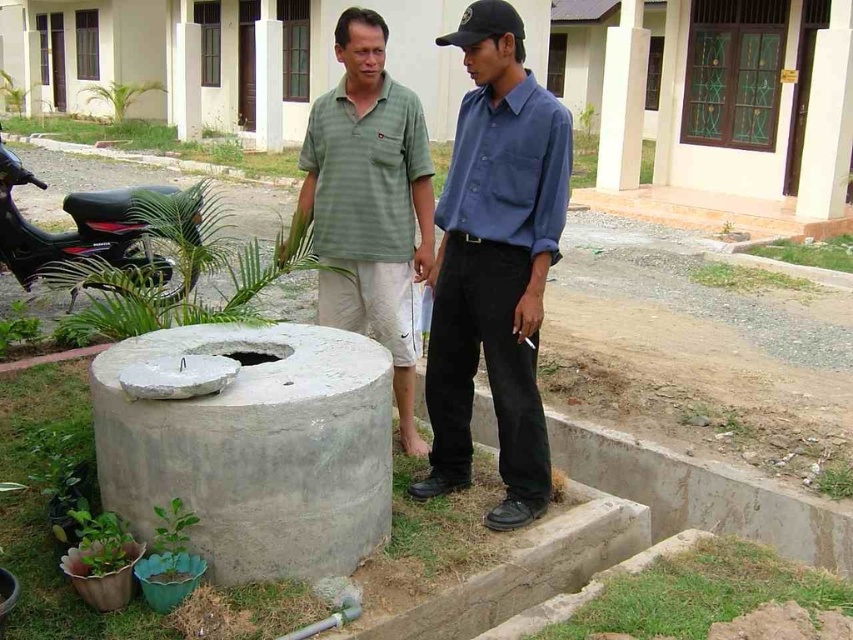
Is gray concrete at lower left positioned behind black matte motorcycle at left?

That is False.

Identify the location of gray concrete at lower left. (254, 449).

Locate an element on the screen. The height and width of the screenshot is (640, 853). gray concrete at lower left is located at coordinates [254, 449].

Which is above, green striped polo shirt at center or black matte motorcycle at left?

black matte motorcycle at left is higher up.

Can you confirm if green striped polo shirt at center is positioned to the left of black matte motorcycle at left?

No, green striped polo shirt at center is not to the left of black matte motorcycle at left.

Is point (351, 81) closer to viewer compared to point (28, 243)?

Yes, point (351, 81) is closer to viewer.

Locate an element on the screen. The width and height of the screenshot is (853, 640). green striped polo shirt at center is located at coordinates (369, 202).

Can you confirm if blue cotton shirt at center is positioned to the left of green striped polo shirt at center?

No, blue cotton shirt at center is not to the left of green striped polo shirt at center.

How distant is blue cotton shirt at center from green striped polo shirt at center?

The distance of blue cotton shirt at center from green striped polo shirt at center is 17.04 inches.

Does point (506, 38) come behind point (366, 244)?

That is False.

Image resolution: width=853 pixels, height=640 pixels. Identify the location of blue cotton shirt at center. (495, 262).